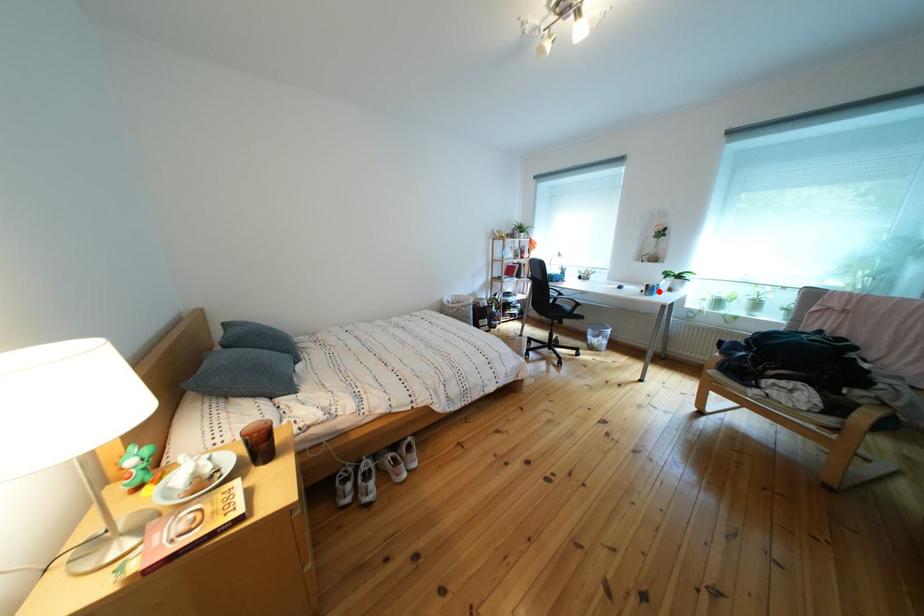
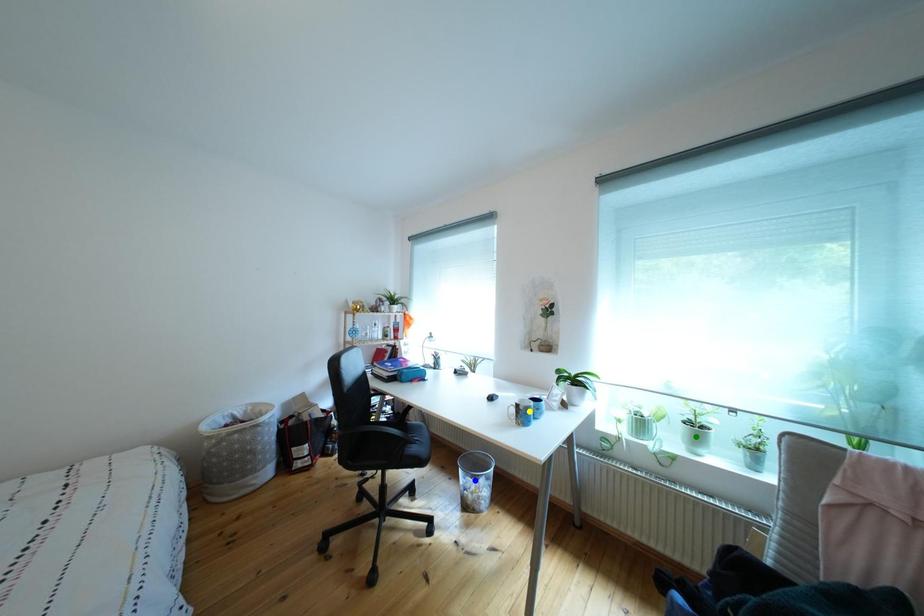
Question: I am providing you with two images of the same scene from different viewpoints. A red point is marked on the first image. You are given multiple points on the second image. Which point in image 2 is actually the same real-world point as the red point in image 1?

Choices:
 (A) yellow point
 (B) green point
 (C) blue point

Answer: (A)